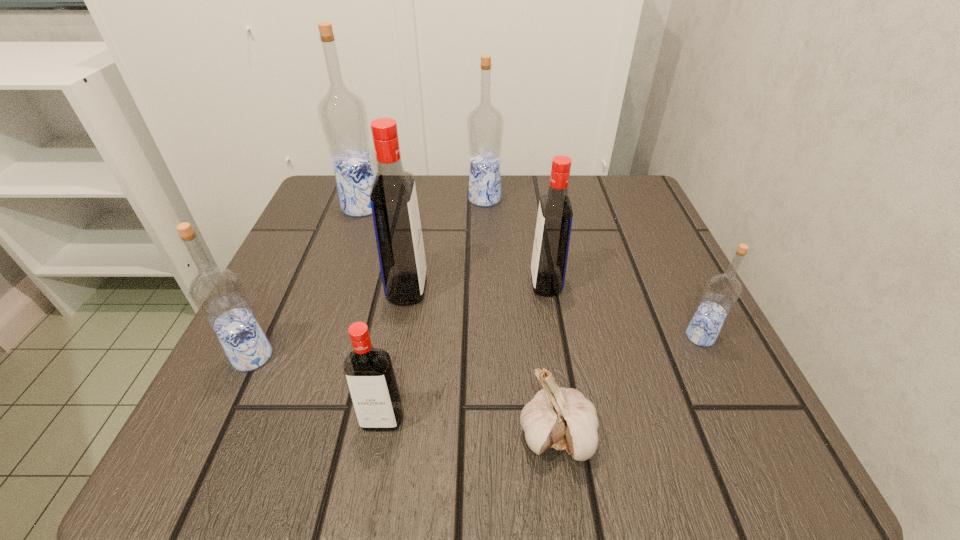
Locate an element on the screen. the third closest blue vodka relative to the second biggest blue vodka is located at coordinates coord(218,293).

Locate an element on the screen. The image size is (960, 540). red vodka that can be found as the second closest to the rightmost blue vodka is located at coordinates (393, 198).

Where is `red vodka that is the second closest to the garlic`? This screenshot has width=960, height=540. red vodka that is the second closest to the garlic is located at coordinates [553, 228].

Locate an element on the screen. The width and height of the screenshot is (960, 540). vacant space that satisfies the following two spatial constraints: 1. on the front and back of the garlic; 2. on the right side of the biggest red vodka is located at coordinates (381, 436).

In order to click on free spot that satisfies the following two spatial constraints: 1. on the front and back of the garlic; 2. on the right side of the smallest red vodka in this screenshot , I will do `click(379, 436)`.

Where is `blank area in the image that satisfies the following two spatial constraints: 1. on the front and back of the second vodka from right to left; 2. on the back side of the rightmost object`? blank area in the image that satisfies the following two spatial constraints: 1. on the front and back of the second vodka from right to left; 2. on the back side of the rightmost object is located at coordinates (555, 336).

Identify the location of vacant area in the image that satisfies the following two spatial constraints: 1. on the front and back of the biggest red vodka; 2. on the front and back of the nearest vodka. This screenshot has height=540, width=960. (385, 420).